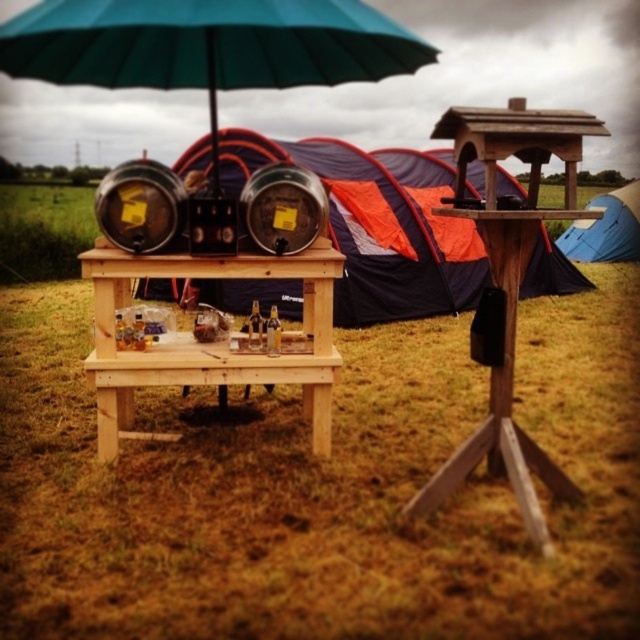
In the scene shown: You are planning to set up a new tent in this camping area. You want to place it to the right of the orange fabric tent at center but to the left of the blue fabric tent at right. Is this possible?

The orange fabric tent at center is positioned on the left side of blue fabric tent at right, so placing a new tent to the right of the orange fabric tent at center but to the left of the blue fabric tent at right is possible between them.

You are planning to set up a new tent in the camping area shown. The tent requires a clear space of 2 meters in diameter. Considering the green fabric umbrella at upper center is located at point 0.072, 0.325, can you place your tent without overlapping with it?

The green fabric umbrella at upper center is located at point (208,45). Since the tent requires a clear space of 2 meters in diameter, you must ensure that the center of the tent is at least 1 meter away from the umbrella to avoid overlap. However, without knowing the exact scale of the coordinate system, it is impossible to determine the actual distance between the umbrella and the desired tent location.